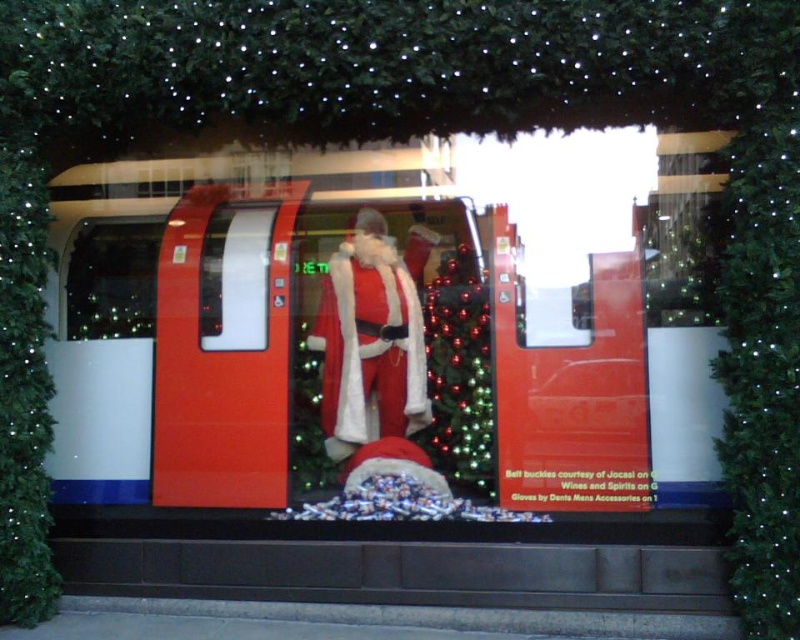
Between shiny red train at center and metallic red train at center, which one has less height?

With less height is metallic red train at center.

Consider the image. Is shiny red train at center to the right of metallic red train at center from the viewer's perspective?

Correct, you'll find shiny red train at center to the right of metallic red train at center.

The image size is (800, 640). What do you see at coordinates (408, 326) in the screenshot?
I see `shiny red train at center` at bounding box center [408, 326].

At what (x,y) coordinates should I click in order to perform the action: click on shiny red train at center. Please return your answer as a coordinate pair (x, y). This screenshot has height=640, width=800. Looking at the image, I should click on (408, 326).

Is shiny red train at center to the left of white fur santa at center from the viewer's perspective?

Correct, you'll find shiny red train at center to the left of white fur santa at center.

Is point (278, 234) less distant than point (366, 360)?

No, (278, 234) is further to viewer.

Where is `shiny red train at center`? Image resolution: width=800 pixels, height=640 pixels. shiny red train at center is located at coordinates (408, 326).

Can you confirm if shiny red train at center is bigger than green matte lights at left?

Yes.

Which is behind, point (352, 301) or point (86, 285)?

The point (86, 285) is behind.

This screenshot has width=800, height=640. Describe the element at coordinates (408, 326) in the screenshot. I see `shiny red train at center` at that location.

I want to click on shiny red train at center, so click(408, 326).